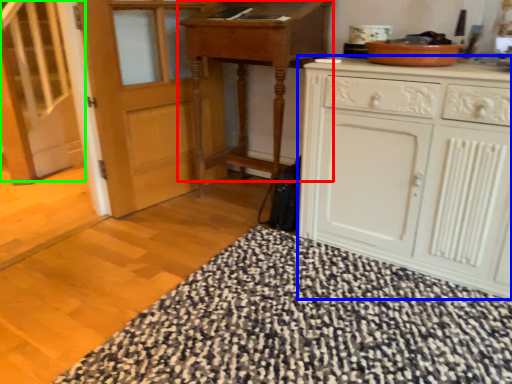
Question: Based on their relative distances, which object is nearer to table (highlighted by a red box)? Choose from cabinetry (highlighted by a blue box) and stairs (highlighted by a green box).

Choices:
 (A) cabinetry
 (B) stairs

Answer: (A)